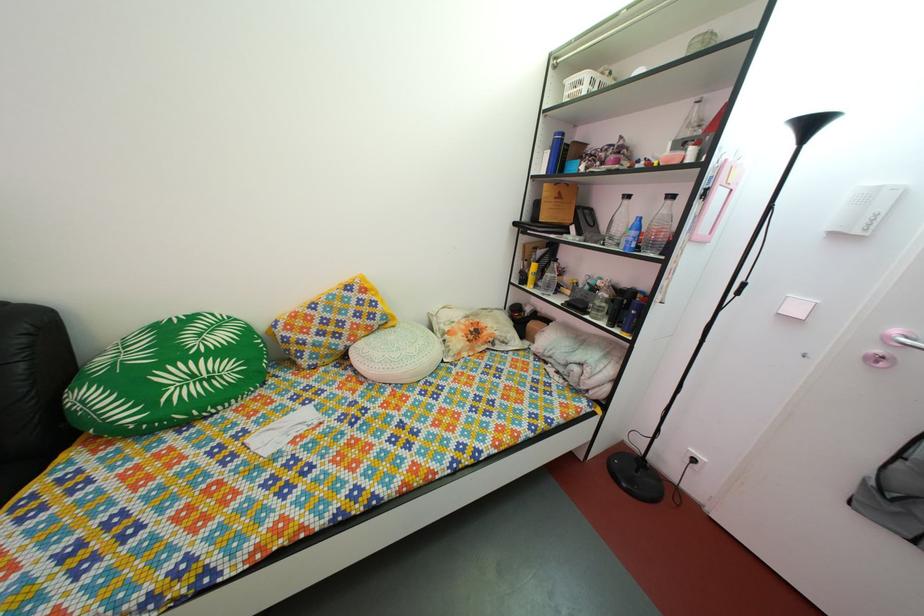
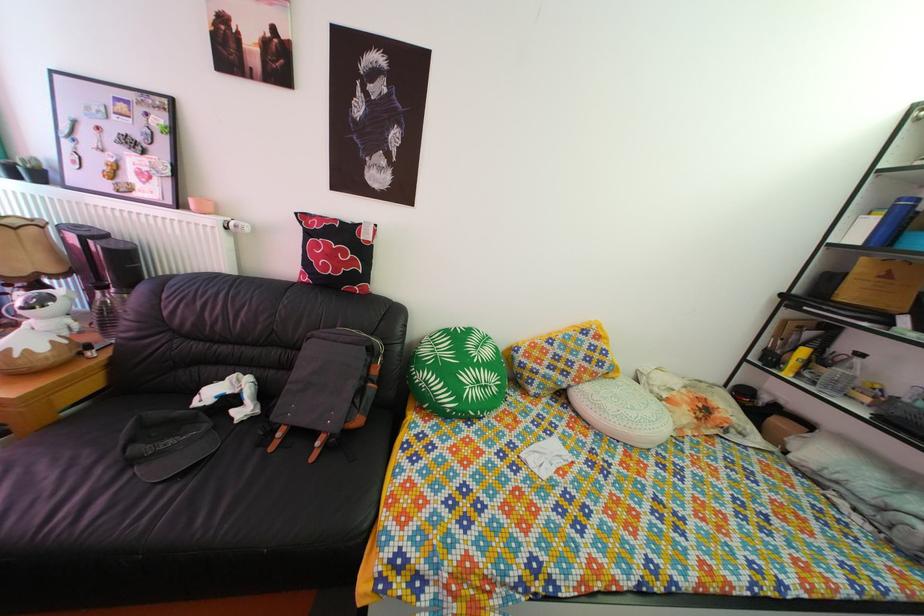
The point at (220, 387) is marked in the first image. Where is the corresponding point in the second image?

(494, 395)